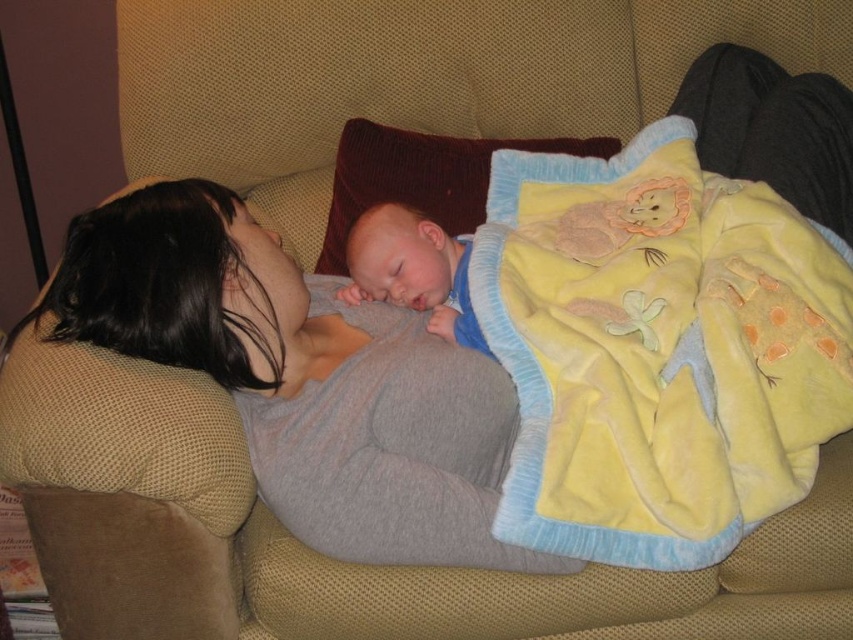
You are a photographer setting up a shoot in this living room. You want to capture the scene where the yellow fleece blanket at lower right and the brown fuzzy pillow at upper center are both visible. However, you notice that the blanket is blocking part of the pillow. Can you adjust your position to ensure both items are fully visible without any obstruction?

The yellow fleece blanket at lower right is in front of the brown fuzzy pillow at upper center. To ensure both are fully visible, move your camera position so that you can see around or behind the blanket to capture the pillow without obstruction.

From the picture: You are a photographer trying to capture a closeup of the baby in the image. The camera you are using has a focus point at coordinate 0.278, 0.495. Is the brown fuzzy pillow at upper center in the way of capturing the baby?

The brown fuzzy pillow at upper center is located at point (421, 177), which is exactly where the camera focus point is. Therefore, the brown fuzzy pillow at upper center is blocking the view of the baby, making it difficult to capture a clear closeup.